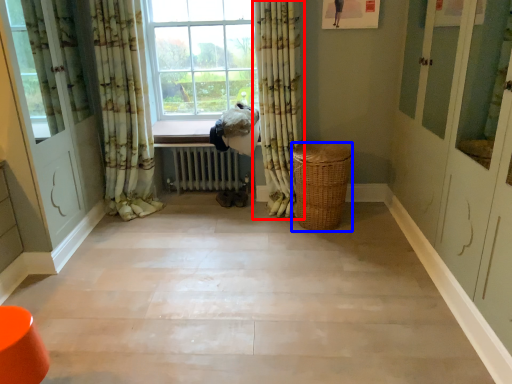
Question: Which of the following is the closest to the observer, curtain (highlighted by a red box) or basket (highlighted by a blue box)?

Choices:
 (A) curtain
 (B) basket

Answer: (A)